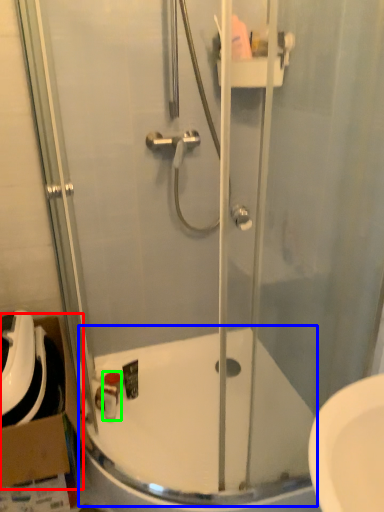
Question: Which object is positioned farthest from cardboard box (highlighted by a red box)? Select from bath (highlighted by a blue box) and toiletry (highlighted by a green box).

Choices:
 (A) bath
 (B) toiletry

Answer: (A)